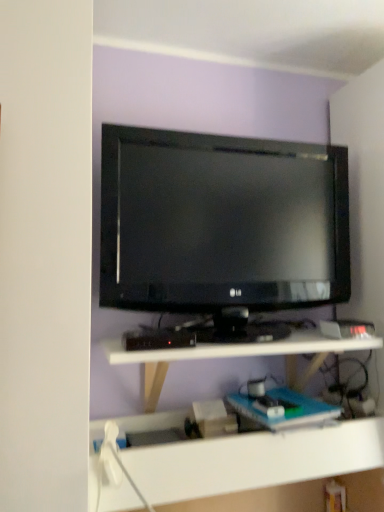
Question: Based on their positions, is white plastic shelf at lower center located to the left or right of black glossy tv at center?

Choices:
 (A) right
 (B) left

Answer: (B)

Question: From the image's perspective, relative to black glossy tv at center, is white plastic shelf at lower center above or below?

Choices:
 (A) above
 (B) below

Answer: (B)

Question: From a real-world perspective, is white plastic shelf at lower center above or below black glossy tv at center?

Choices:
 (A) below
 (B) above

Answer: (A)

Question: In the image, is black glossy tv at center positioned in front of or behind white plastic shelf at lower center?

Choices:
 (A) front
 (B) behind

Answer: (B)

Question: From their relative heights in the image, would you say black glossy tv at center is taller or shorter than white plastic shelf at lower center?

Choices:
 (A) tall
 (B) short

Answer: (A)

Question: Is black glossy tv at center to the left or to the right of white plastic shelf at lower center in the image?

Choices:
 (A) left
 (B) right

Answer: (B)

Question: Considering the positions of point (279, 236) and point (294, 332), is point (279, 236) closer or farther from the camera than point (294, 332)?

Choices:
 (A) farther
 (B) closer

Answer: (B)